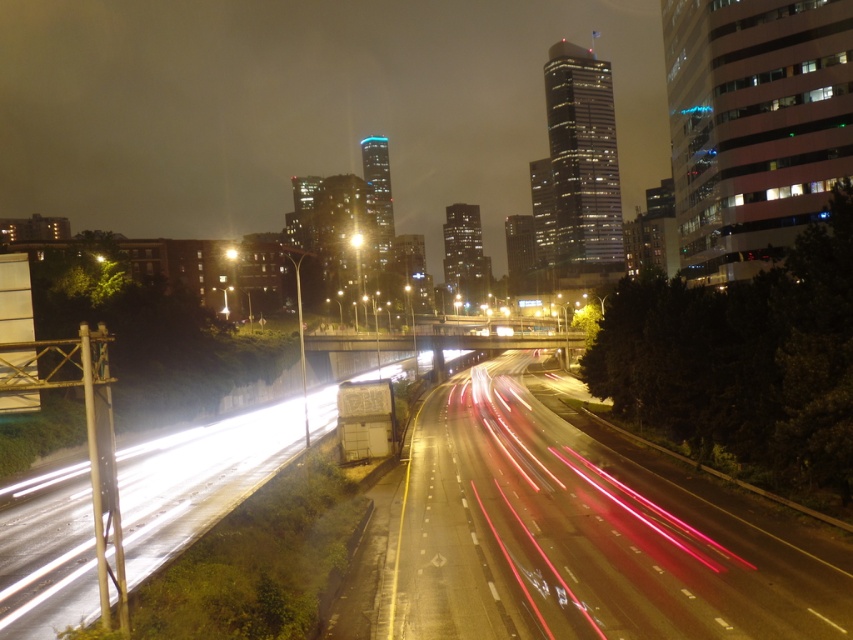
Which is below, metallic asphalt highway at center or bright yellow light at center?

Positioned lower is metallic asphalt highway at center.

Which of these two, metallic asphalt highway at center or bright yellow light at center, stands shorter?

Standing shorter between the two is metallic asphalt highway at center.

At what (x,y) coordinates should I click in order to perform the action: click on metallic asphalt highway at center. Please return your answer as a coordinate pair (x, y). Image resolution: width=853 pixels, height=640 pixels. Looking at the image, I should click on (570, 538).

You are a GUI agent. You are given a task and a screenshot of the screen. Output one action in this format:
    pyautogui.click(x=<x>, y=<y>)
    Task: Click on the metallic asphalt highway at center
    
    Given the screenshot: What is the action you would take?
    pyautogui.click(x=570, y=538)